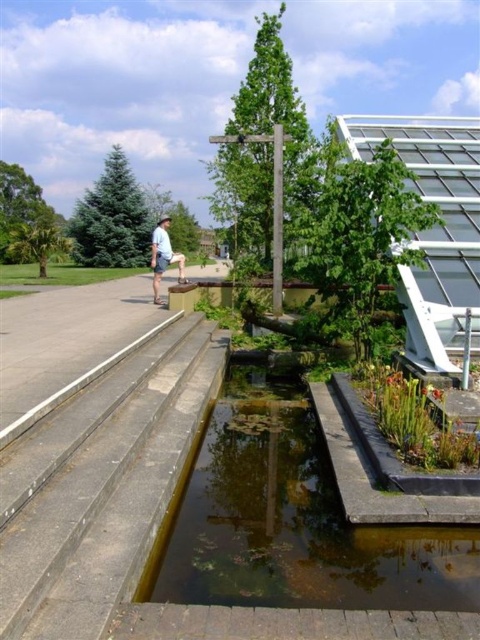
Which of these two, green mossy concrete water at center or light blue denim shorts at left, stands taller?

light blue denim shorts at left

Can you confirm if green mossy concrete water at center is positioned above light blue denim shorts at left?

Incorrect, green mossy concrete water at center is not positioned above light blue denim shorts at left.

Identify the location of green mossy concrete water at center. pyautogui.click(x=294, y=518).

Is green leafy plants at center thinner than light blue denim shorts at left?

Correct, green leafy plants at center's width is less than light blue denim shorts at left's.

Who is positioned more to the left, green leafy plants at center or light blue denim shorts at left?

Positioned to the left is light blue denim shorts at left.

Where is `green leafy plants at center`? green leafy plants at center is located at coordinates (x=415, y=419).

Identify the location of green leafy plants at center. (415, 419).

How distant is green mossy concrete water at center from gray concrete steps at lower left?

green mossy concrete water at center is 28.00 inches away from gray concrete steps at lower left.

Does green mossy concrete water at center come in front of gray concrete steps at lower left?

That is False.

Who is more distant from viewer, (201, 536) or (6, 636)?

Positioned behind is point (201, 536).

The width and height of the screenshot is (480, 640). In order to click on green mossy concrete water at center in this screenshot , I will do `click(294, 518)`.